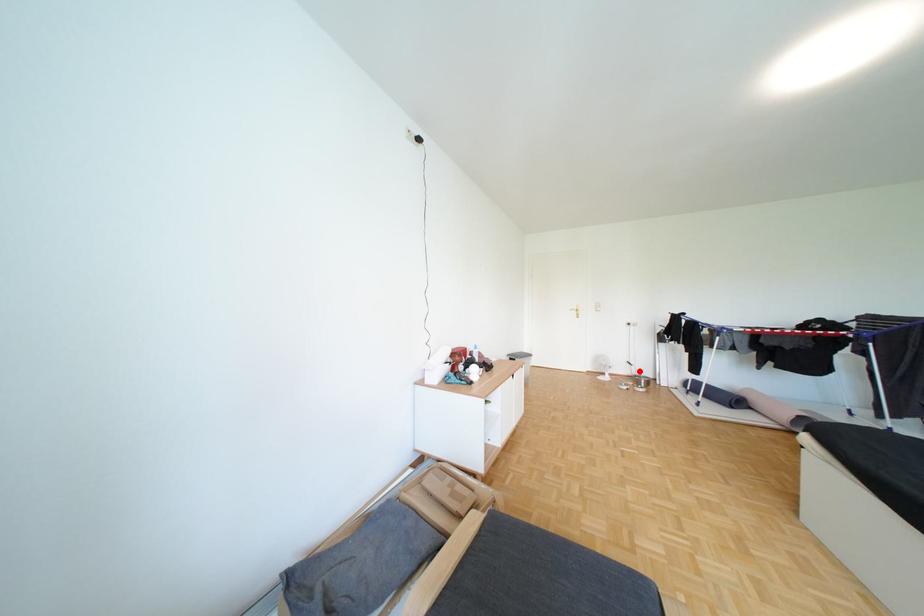
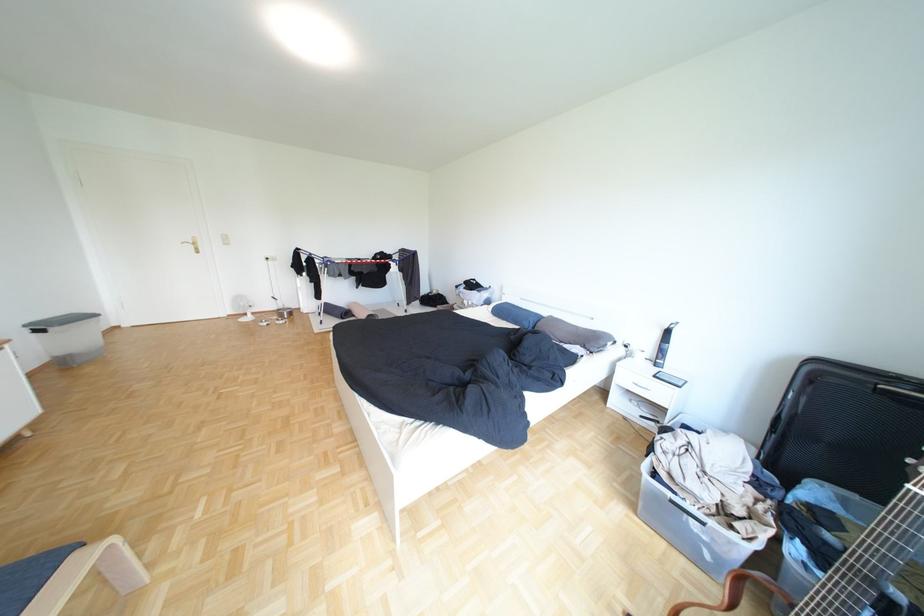
Where in the second image is the point corresponding to the highlighted location from the first image?

(286, 307)